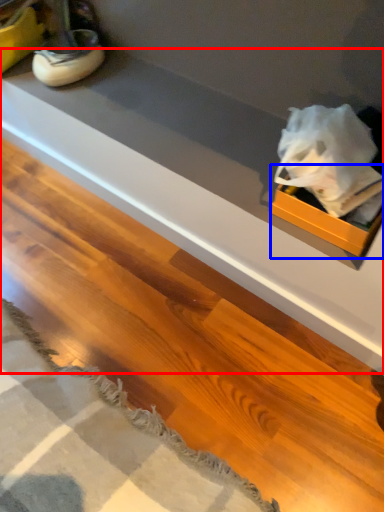
Question: Which point is closer to the camera, counter top (highlighted by a red box) or box (highlighted by a blue box)?

Choices:
 (A) counter top
 (B) box

Answer: (B)